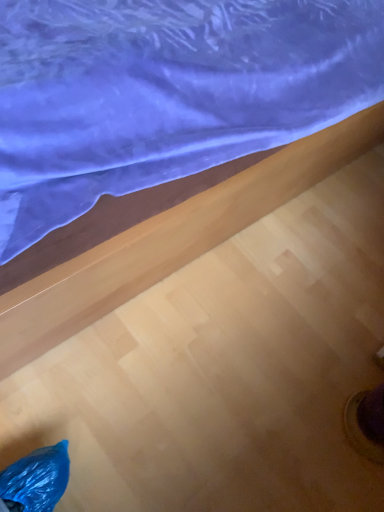
Identify the location of wooden floor at upper center. (170, 240).

The height and width of the screenshot is (512, 384). Describe the element at coordinates (170, 240) in the screenshot. I see `wooden floor at upper center` at that location.

The height and width of the screenshot is (512, 384). Find the location of `wooden floor at upper center`. wooden floor at upper center is located at coordinates (170, 240).